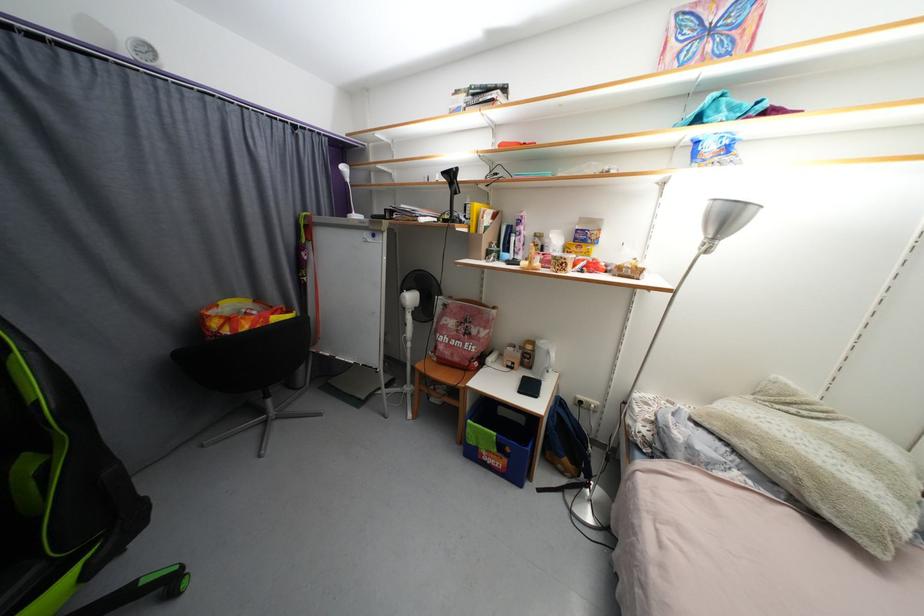
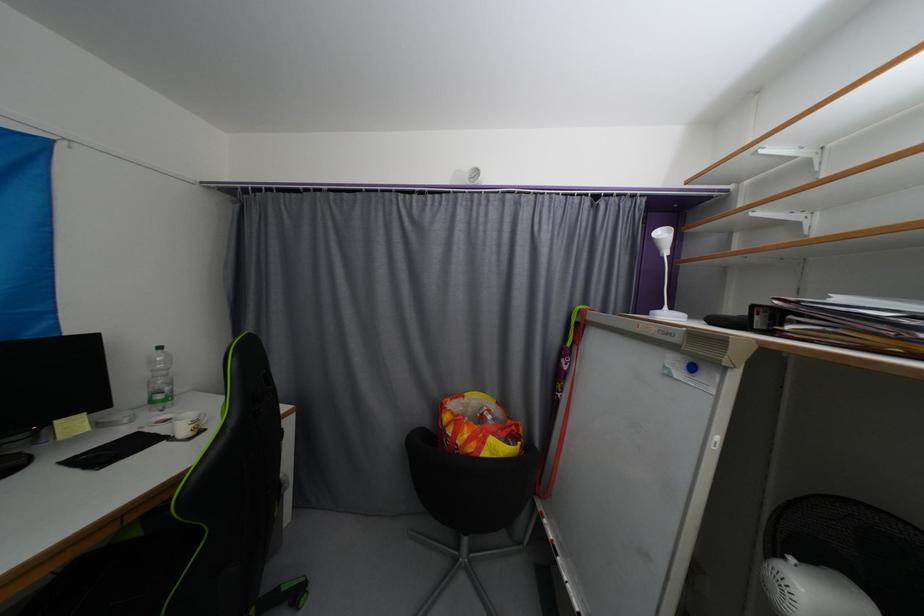
The point at [360,217] is marked in the first image. Where is the corresponding point in the second image?

(672, 317)